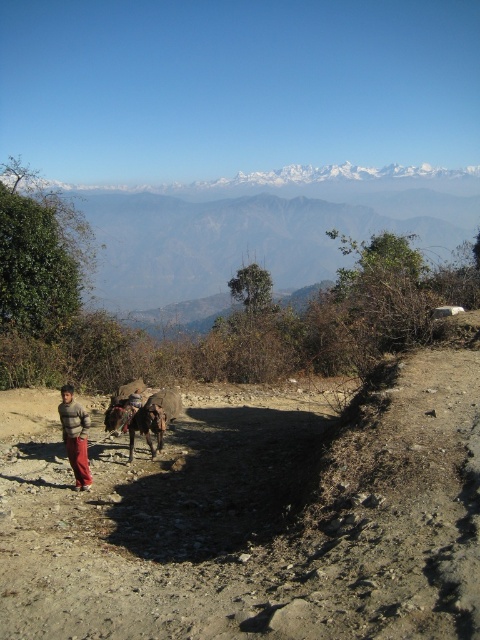
You are standing on the dirt path and want to take a photo of the snowy rocky mountain at upper center and the knitted sweater at lower left. Which object should you focus on first if you want both to be in the same frame without moving the camera?

The snowy rocky mountain at upper center is located above the knitted sweater at lower left, so you should focus on the knitted sweater at lower left first to ensure both are in the same frame without moving the camera.

You are standing at the point labeled point (71, 579) and want to walk to the point labeled point (127, 413). Based on the terrain described in the scene, will you have to climb uphill or downhill during your journey?

You will have to climb uphill because point (71, 579) is closer to the viewer than point (127, 413), which means the latter is further away and likely at a higher elevation.